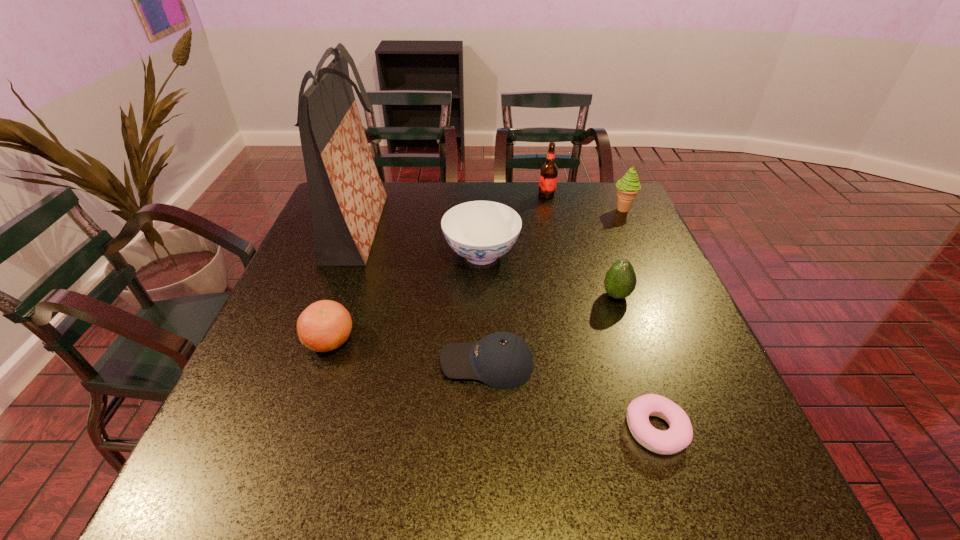
Identify the location of object that is at the far right corner. (627, 188).

You are a GUI agent. You are given a task and a screenshot of the screen. Output one action in this format:
    pyautogui.click(x=<x>, y=<y>)
    Task: Click on the object that is at the near right corner
    Image resolution: width=960 pixels, height=540 pixels.
    Given the screenshot: What is the action you would take?
    pyautogui.click(x=679, y=435)

Where is `vacant space at the far edge of the desktop`? The height and width of the screenshot is (540, 960). vacant space at the far edge of the desktop is located at coordinates (576, 200).

Find the location of a particular element. This screenshot has width=960, height=540. free region at the near edge is located at coordinates (282, 506).

Identify the location of vacant space at the left edge of the desktop. (349, 279).

Locate an element on the screen. This screenshot has height=540, width=960. free space at the right edge of the desktop is located at coordinates (653, 306).

I want to click on vacant space at the far right corner of the desktop, so [592, 185].

At what (x,y) coordinates should I click in order to perform the action: click on free spot between the shortest object and the chinaware. Please return your answer as a coordinate pair (x, y). Looking at the image, I should click on (569, 342).

You are a GUI agent. You are given a task and a screenshot of the screen. Output one action in this format:
    pyautogui.click(x=<x>, y=<y>)
    Task: Click on the empty space that is in between the rightmost object and the shortest object
    Image resolution: width=960 pixels, height=540 pixels.
    Given the screenshot: What is the action you would take?
    pyautogui.click(x=639, y=320)

Where is `free space between the seventh tallest object and the fourth nearest object`? The image size is (960, 540). free space between the seventh tallest object and the fourth nearest object is located at coordinates (552, 329).